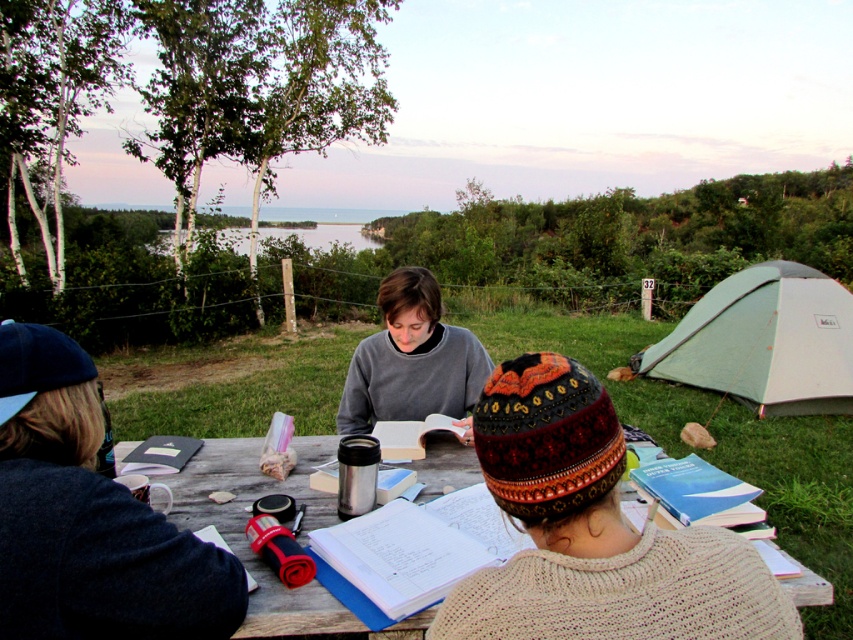
You are a photographer trying to capture a photo of the wooden table at center and the gray sweater at center. Based on their heights, which object should you adjust your camera angle to focus on first?

The wooden table at center is shorter than gray sweater at center, so you should adjust your camera angle to focus on the wooden table at center first since it is lower in height.

You are sitting at the wooden table at center and want to place your knitted woolen hat at lower right on the table. Is the hat currently on the table or in front of it?

The knitted woolen hat at lower right is in front of the wooden table at center, so it is not currently on the table.

You are planning to set up a small camping tent that requires a minimum height of 1.5 meters. Based on the scene, can the white fabric tent at right accommodate someone wearing the gray sweater at center while standing up?

The white fabric tent at right is much taller than the gray sweater at center, so it can accommodate someone wearing the gray sweater at center while standing up as the height requirement of 1.5 meters is likely met.